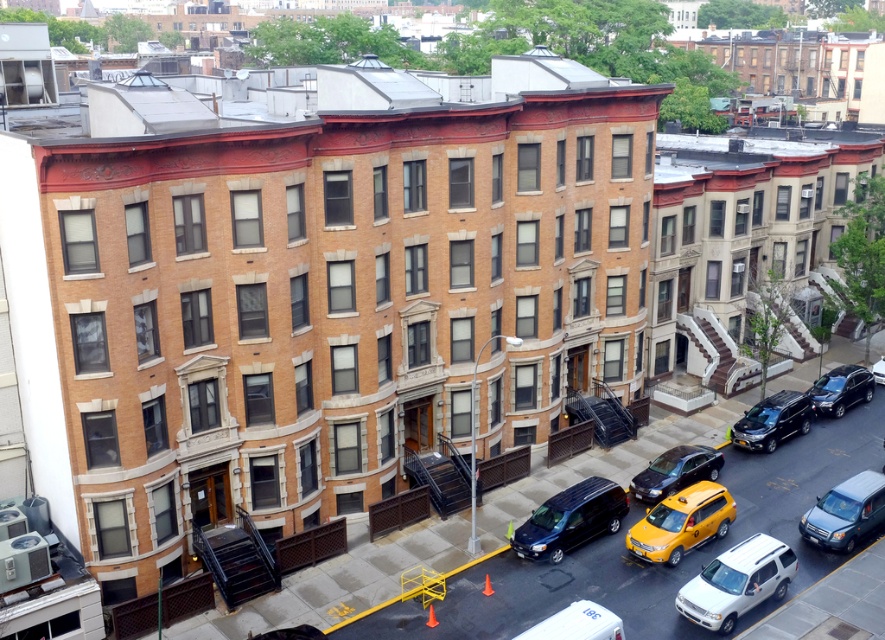
Question: Which of the following is the farthest from the observer?

Choices:
 (A) (535, 540)
 (B) (857, 381)
 (C) (774, 440)
 (D) (680, 604)

Answer: (B)

Question: Is dark gray van at lower right thinner than shiny black sedan at center?

Choices:
 (A) no
 (B) yes

Answer: (B)

Question: Which object is positioned closest to the shiny black sedan at center?

Choices:
 (A) yellow matte taxi at center
 (B) shiny black car at center

Answer: (A)

Question: Based on their relative distances, which object is farther from the white matte suv at center?

Choices:
 (A) shiny black suv at lower right
 (B) yellow matte taxi at center
 (C) shiny black van at center
 (D) shiny black sedan at center

Answer: (A)

Question: Can you confirm if yellow matte taxi at center is bigger than dark gray van at lower right?

Choices:
 (A) no
 (B) yes

Answer: (B)

Question: Does shiny black suv at lower right appear on the left side of shiny black car at center?

Choices:
 (A) no
 (B) yes

Answer: (B)